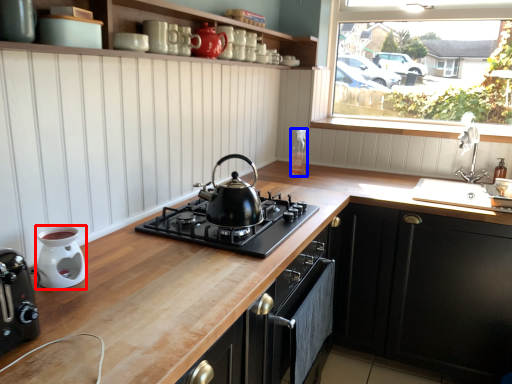
Question: Which object is further to the camera taking this photo, appliance (highlighted by a red box) or appliance (highlighted by a blue box)?

Choices:
 (A) appliance
 (B) appliance

Answer: (B)